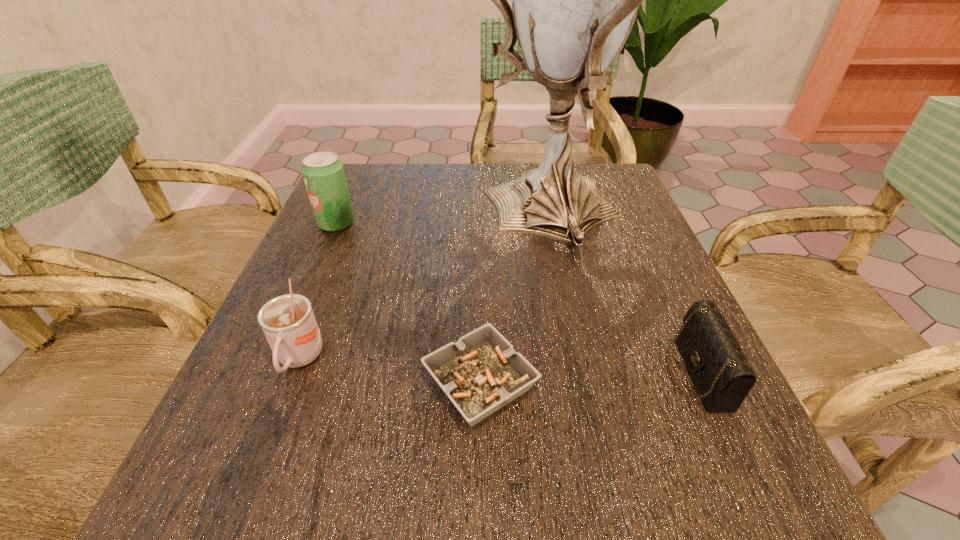
Identify the location of unoccupied area between the second tallest object and the third tallest object. The height and width of the screenshot is (540, 960). (318, 292).

This screenshot has width=960, height=540. I want to click on vacant area that lies between the third shortest object and the tallest object, so click(423, 287).

The height and width of the screenshot is (540, 960). Find the location of `vacant region between the fourth shortest object and the clutch bag`. vacant region between the fourth shortest object and the clutch bag is located at coordinates point(516,298).

Locate an element on the screen. free space between the fourth tallest object and the fourth shortest object is located at coordinates tap(516, 298).

Locate an element on the screen. The image size is (960, 540). vacant area that lies between the shortest object and the soda is located at coordinates (408, 303).

The height and width of the screenshot is (540, 960). I want to click on vacant space that's between the tallest object and the soda, so pyautogui.click(x=443, y=219).

At what (x,y) coordinates should I click in order to perform the action: click on object that ranks as the closest to the third tallest object. Please return your answer as a coordinate pair (x, y). The image size is (960, 540). Looking at the image, I should click on (480, 373).

At what (x,y) coordinates should I click in order to perform the action: click on object that is the closest to the tallest object. Please return your answer as a coordinate pair (x, y). The image size is (960, 540). Looking at the image, I should click on (722, 375).

The image size is (960, 540). Identify the location of vacant space that satisfies the following two spatial constraints: 1. on the front flap of the clutch bag; 2. on the front side of the ashtray. 701,383.

At what (x,y) coordinates should I click in order to perform the action: click on vacant space that satisfies the following two spatial constraints: 1. on the back side of the shortest object; 2. on the right side of the trophy cup. Please return your answer as a coordinate pair (x, y). The width and height of the screenshot is (960, 540). Looking at the image, I should click on (480, 214).